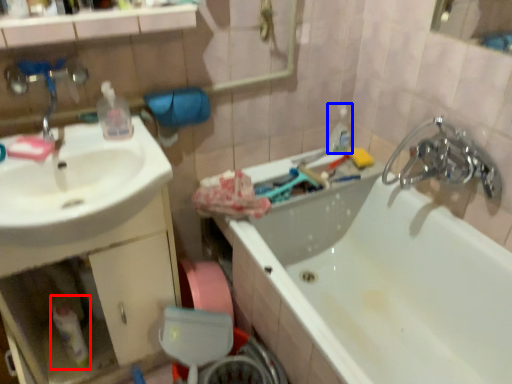
Question: Which of the following is the farthest to the observer, bottle (highlighted by a red box) or toiletry (highlighted by a blue box)?

Choices:
 (A) bottle
 (B) toiletry

Answer: (B)